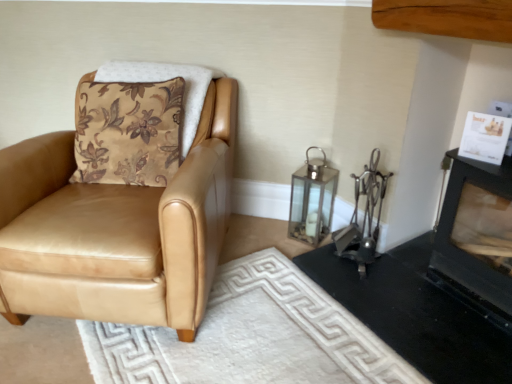
Question: From the image's perspective, relative to clear glass lantern at center-right, is white textured rug at lower center above or below?

Choices:
 (A) above
 (B) below

Answer: (B)

Question: From their relative heights in the image, would you say white textured rug at lower center is taller or shorter than clear glass lantern at center-right?

Choices:
 (A) tall
 (B) short

Answer: (B)

Question: Which is nearer to the clear glass lantern at center-right?

Choices:
 (A) tan leather chair at left
 (B) black matte fireplace at lower right, which is the 1th fireplace from bottom to top
 (C) black matte fireplace at upper right, placed as the second fireplace when sorted from bottom to top
 (D) white textured rug at lower center

Answer: (B)

Question: Which of these objects is positioned farthest from the white textured rug at lower center?

Choices:
 (A) black matte fireplace at upper right, placed as the second fireplace when sorted from bottom to top
 (B) black matte fireplace at lower right, which is the 1th fireplace from bottom to top
 (C) clear glass lantern at center-right
 (D) tan leather chair at left

Answer: (A)